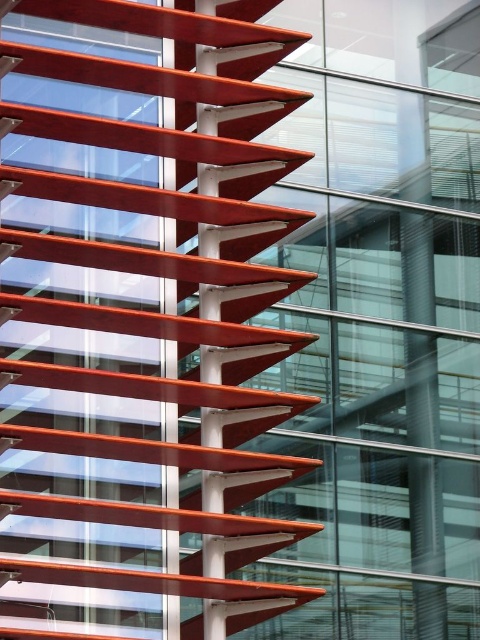
Question: Where is matte red staircase at left located in relation to metallic orange staircase at center in the image?

Choices:
 (A) right
 (B) left

Answer: (B)

Question: Which object appears closest to the camera in this image?

Choices:
 (A) metallic orange staircase at center
 (B) matte red staircase at left

Answer: (A)

Question: Is matte red staircase at left closer to camera compared to metallic orange staircase at center?

Choices:
 (A) yes
 (B) no

Answer: (B)

Question: Among these objects, which one is farthest from the camera?

Choices:
 (A) metallic orange staircase at center
 (B) matte red staircase at left

Answer: (B)

Question: Is matte red staircase at left closer to the viewer compared to metallic orange staircase at center?

Choices:
 (A) no
 (B) yes

Answer: (A)

Question: Which object is farther from the camera taking this photo?

Choices:
 (A) metallic orange staircase at center
 (B) matte red staircase at left

Answer: (B)